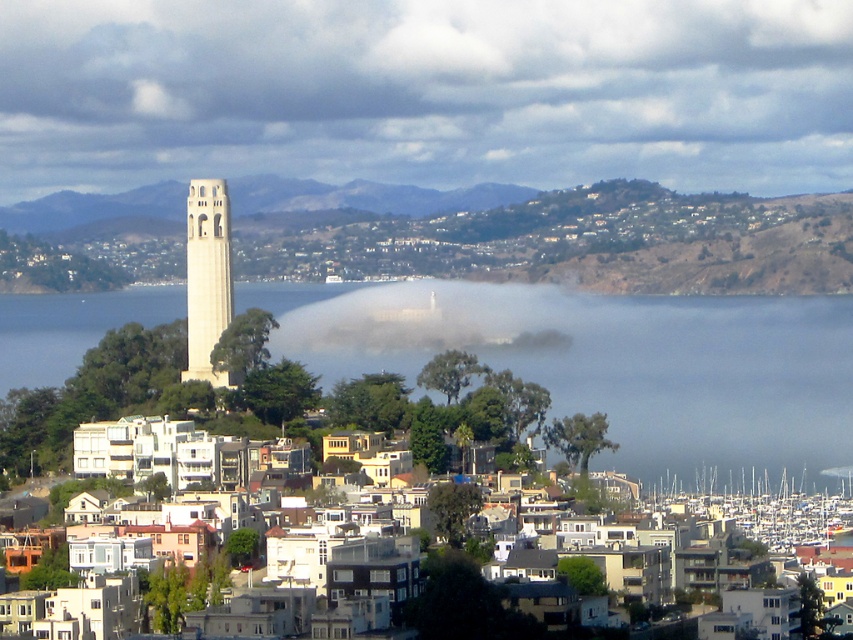
You are a photographer planning to capture the entire view of the coastal cityscape. You have a wide angle lens that can cover up to 100 meters in width. The distance between the white translucent fog at center and the white stone bell tower at left is 80 meters. Can your lens capture both objects in one frame?

The distance between the white translucent fog at center and the white stone bell tower at left is 80 meters, which is within the 100 meters coverage of your wide angle lens. Therefore, your lens can capture both objects in one frame.

You are a photographer planning to capture the Coit Tower against the backdrop of the coastal cityscape. You notice two white elements at the center of the scene. Which one is wider, the white mist at center or the white translucent fog at center?

The white mist at center is wider than the white translucent fog at center according to the description.